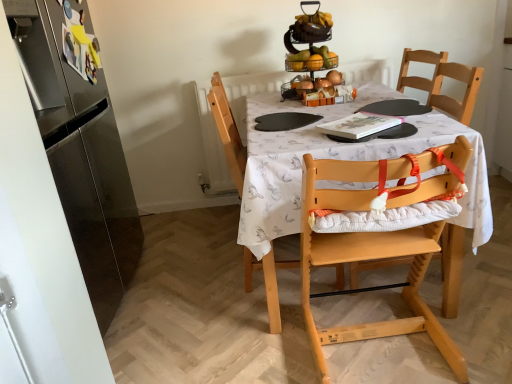
The image size is (512, 384). Find the location of `free location in front of light wood highchair at center, which is the second chair in front-to-back order`. free location in front of light wood highchair at center, which is the second chair in front-to-back order is located at coordinates tap(263, 334).